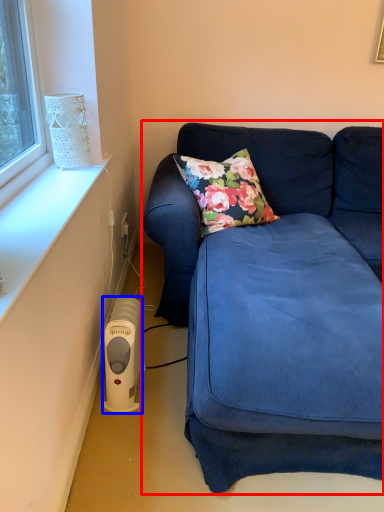
Question: Which object appears closest to the camera in this image, studio couch (highlighted by a red box) or appliance (highlighted by a blue box)?

Choices:
 (A) studio couch
 (B) appliance

Answer: (A)